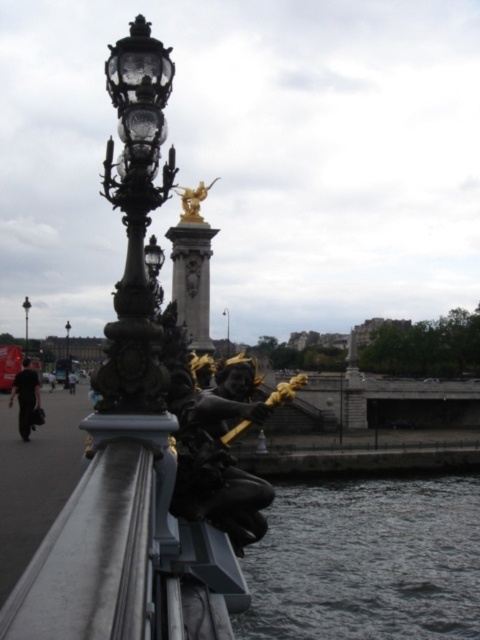
Can you confirm if white marble column at center is positioned above black polished street light at upper left?

Correct, white marble column at center is located above black polished street light at upper left.

Who is lower down, white marble column at center or black polished street light at upper left?

black polished street light at upper left is below.

Is point (195, 288) in front of point (68, 384)?

No, it is behind (68, 384).

You are a GUI agent. You are given a task and a screenshot of the screen. Output one action in this format:
    pyautogui.click(x=<x>, y=<y>)
    Task: Click on the white marble column at center
    
    Given the screenshot: What is the action you would take?
    pyautogui.click(x=192, y=278)

Is black polished statue at center shorter than matte black street light at upper left?

Indeed, black polished statue at center has a lesser height compared to matte black street light at upper left.

Measure the distance between black polished statue at center and matte black street light at upper left.

The distance of black polished statue at center from matte black street light at upper left is 438.31 feet.

Find the location of `black polished statue at center`. black polished statue at center is located at coordinates (224, 452).

Is polished bronze street light at left to the right of black polished street light at upper left from the viewer's perspective?

Indeed, polished bronze street light at left is positioned on the right side of black polished street light at upper left.

Is polished bronze street light at left smaller than black polished street light at upper left?

Indeed, polished bronze street light at left has a smaller size compared to black polished street light at upper left.

Between point (156, 131) and point (66, 369), which one is positioned in front?

Point (156, 131) is in front.

The image size is (480, 640). In order to click on polished bronze street light at left in this screenshot , I will do `click(135, 220)`.